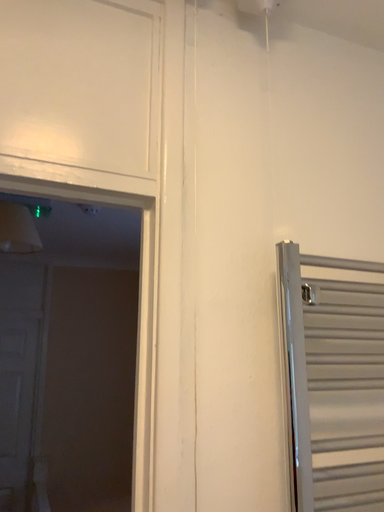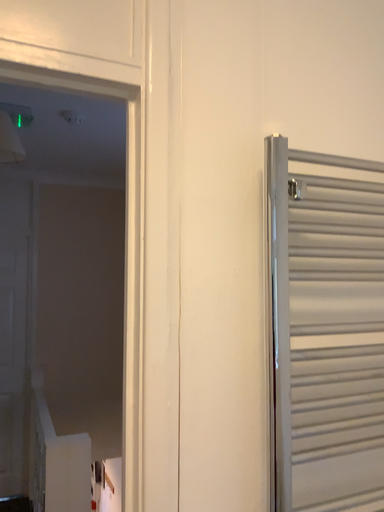
Question: How did the camera likely rotate when shooting the video?

Choices:
 (A) rotated upward
 (B) rotated downward

Answer: (B)